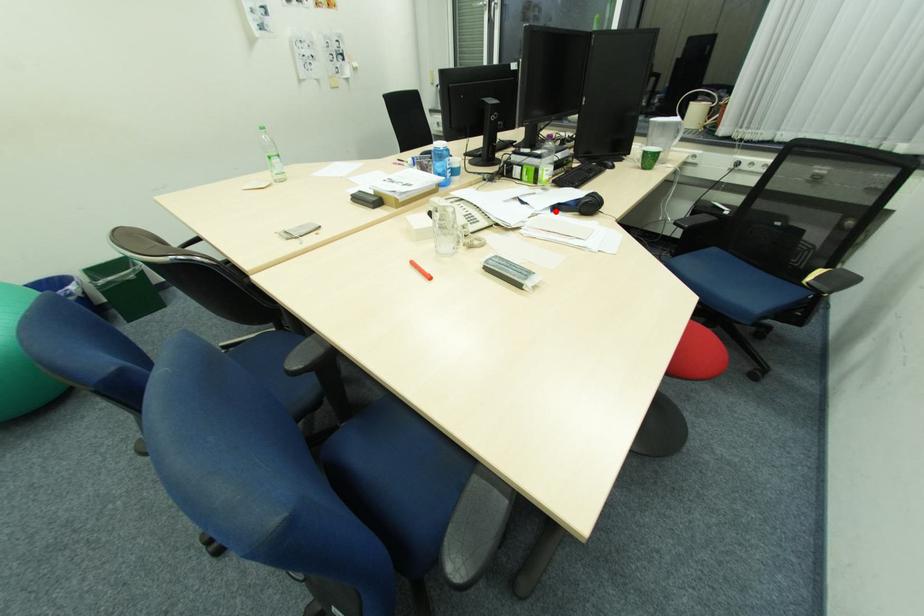
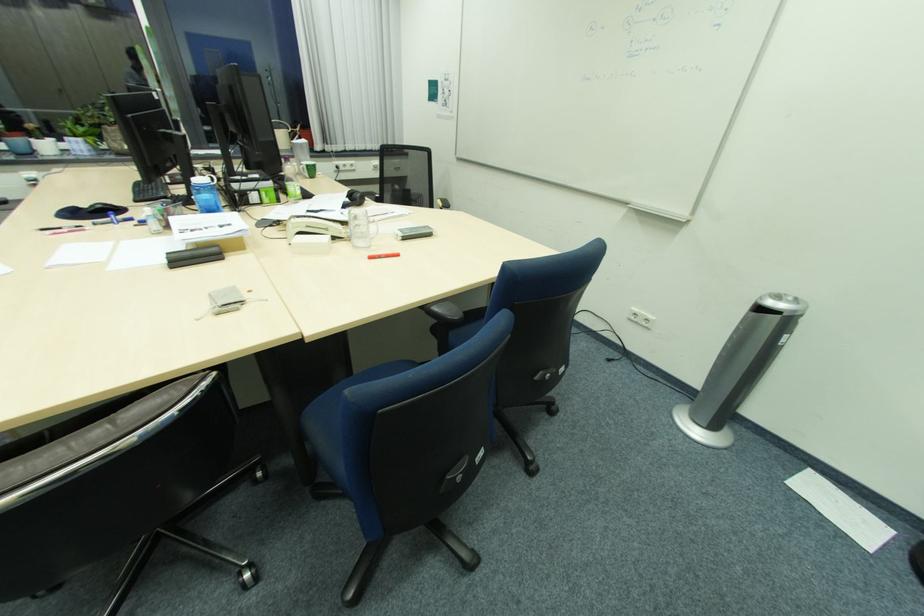
In the second image, find the point that corresponds to the highlighted location in the first image.

(349, 209)